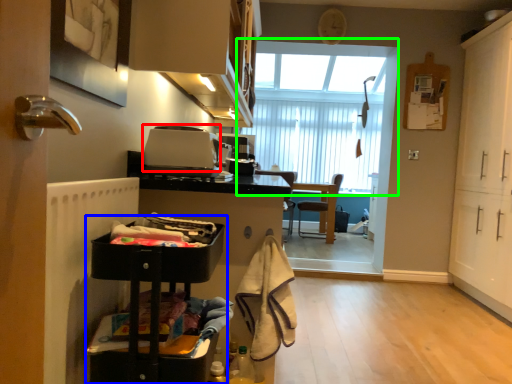
Question: Which object is positioned farthest from appliance (highlighted by a red box)? Select from cabinetry (highlighted by a blue box) and window (highlighted by a green box).

Choices:
 (A) cabinetry
 (B) window

Answer: (B)